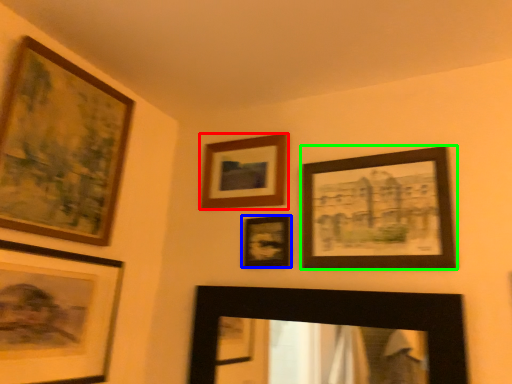
Question: Estimate the real-world distances between objects in this image. Which object is closer to picture frame (highlighted by a red box), picture frame (highlighted by a blue box) or picture frame (highlighted by a green box)?

Choices:
 (A) picture frame
 (B) picture frame

Answer: (A)